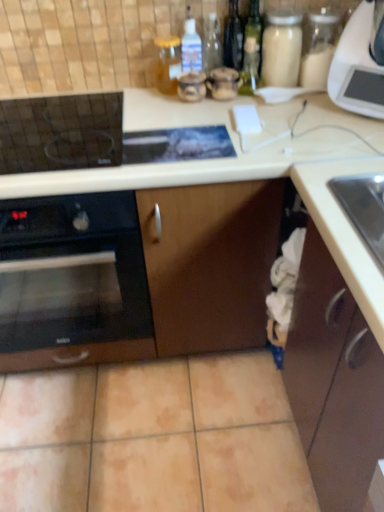
The width and height of the screenshot is (384, 512). Identify the location of free space in front of translucent glass jar at upper center. (164, 113).